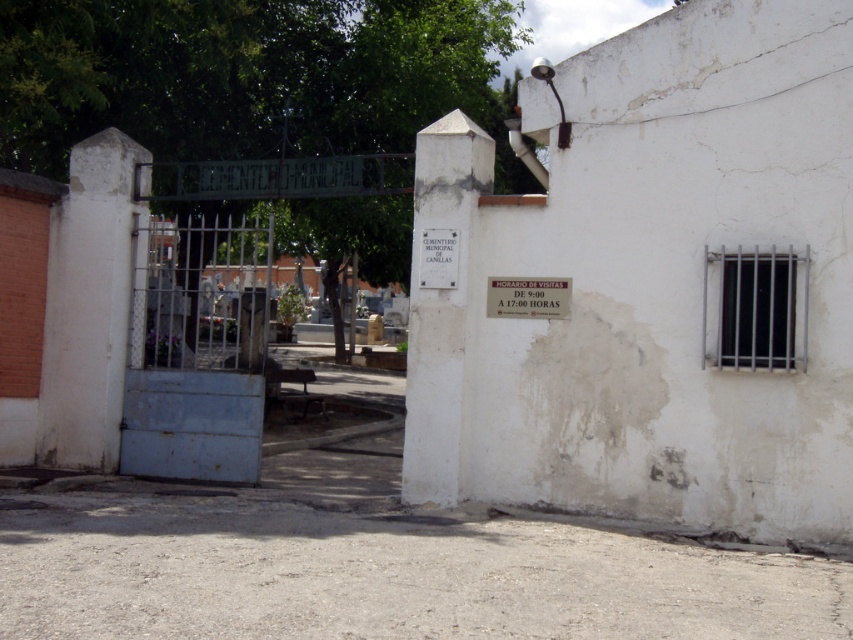
Question: Can you confirm if rusty metal gate at center is thinner than white paper sign at upper center?

Choices:
 (A) yes
 (B) no

Answer: (B)

Question: Which of the following is the farthest from the observer?

Choices:
 (A) pyautogui.click(x=556, y=301)
 (B) pyautogui.click(x=148, y=321)

Answer: (B)

Question: In this image, where is rusty metal gate at center located relative to white paper sign at upper center?

Choices:
 (A) above
 (B) below

Answer: (A)

Question: From the image, what is the correct spatial relationship of rusty metal gate at center in relation to white paper sign at upper center?

Choices:
 (A) below
 (B) above

Answer: (B)